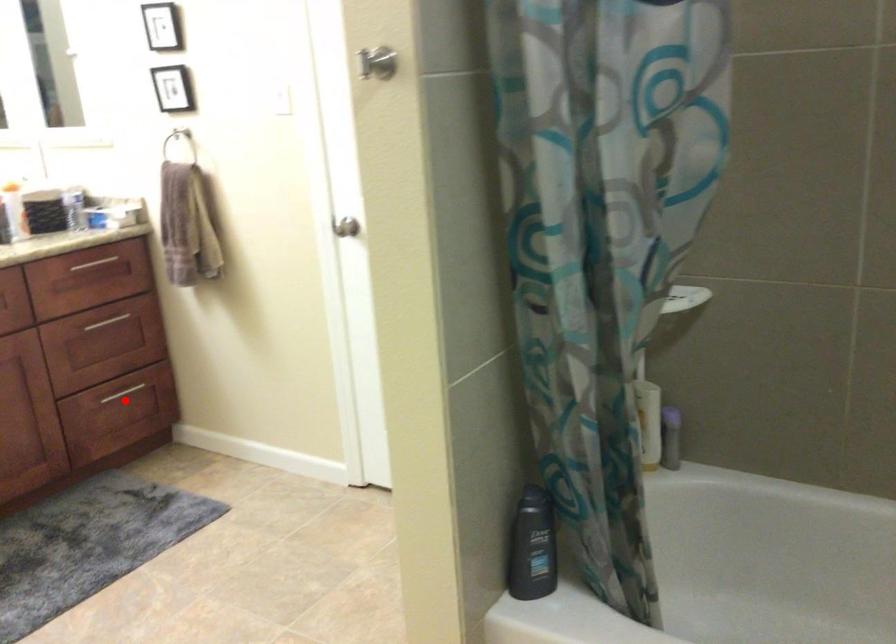
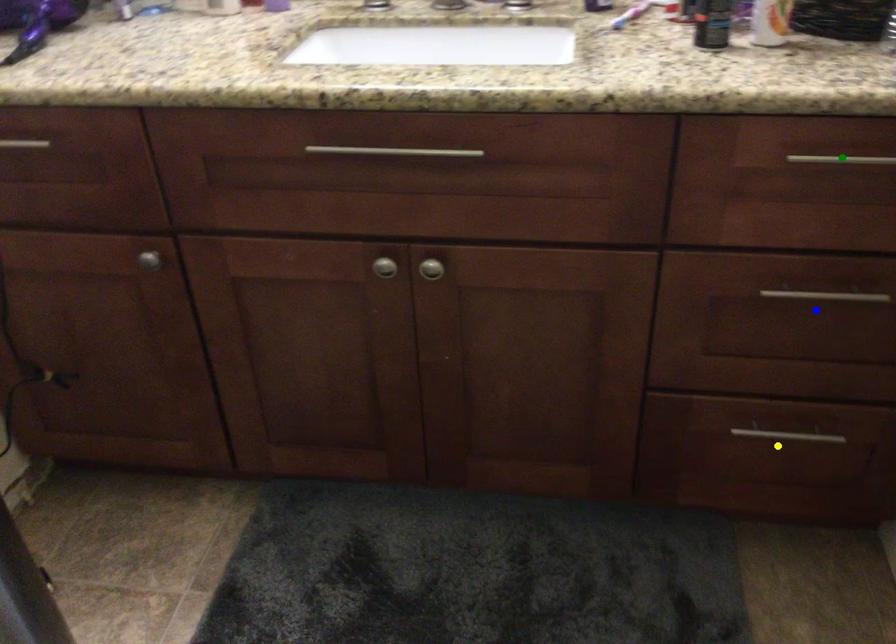
Question: I am providing you with two images of the same scene from different viewpoints. A red point is marked on the first image. You are given multiple points on the second image. Which mark in image 2 goes with the point in image 1?

Choices:
 (A) blue point
 (B) yellow point
 (C) green point

Answer: (B)